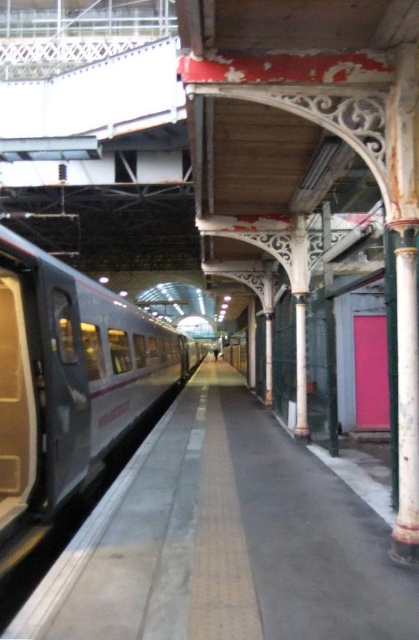
You are a maintenance worker who needs to inspect the gap between the smooth gray platform at center and the silver metallic train at left. According to safety regulations, the maximum allowable gap is 2.5 meters. Can you safely proceed with the inspection without any special equipment?

The distance between the smooth gray platform at center and the silver metallic train at left is 3.04 meters, which exceeds the maximum allowable gap of 2.5 meters. Therefore, you cannot safely proceed with the inspection without additional equipment.

You are standing on the train station platform and want to move to the tactile paving strip for safety. Given that the tactile paving strip is part of the smooth gray platform at center, can you determine the direction you should walk from your current position to reach it?

The smooth gray platform at center is located at point (224, 540), so you should walk towards that coordinate to reach the tactile paving strip.